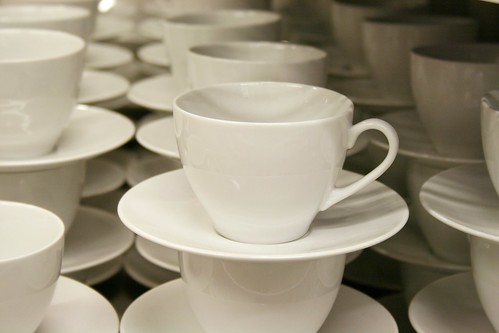
Locate an element on the screen. Image resolution: width=499 pixels, height=333 pixels. inside of cup is located at coordinates (10, 230), (6, 38), (24, 12), (223, 16), (254, 49), (268, 110), (461, 58).